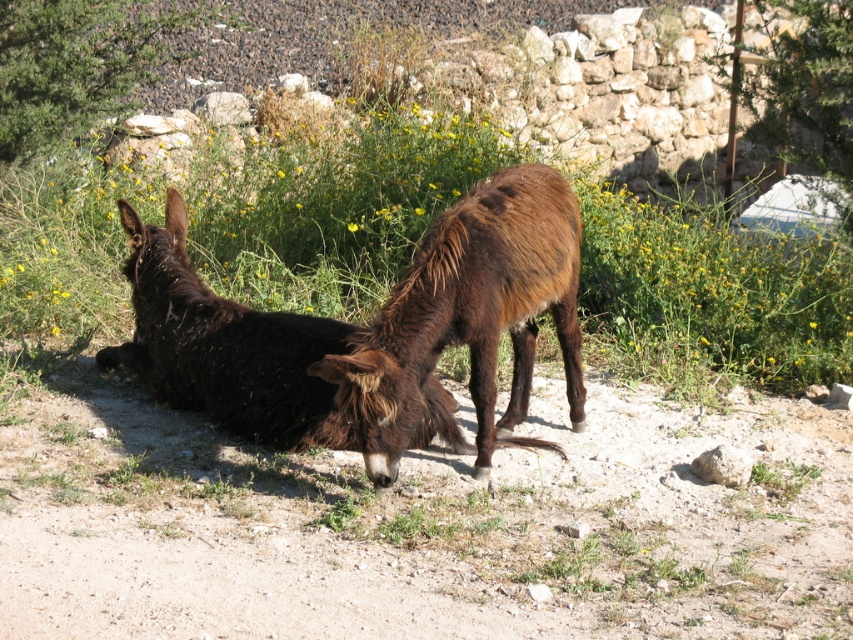
Question: Which of the following is the closest to the observer?

Choices:
 (A) brown fuzzy donkey at center
 (B) dark brown fur donkey at lower left

Answer: (A)

Question: Can you confirm if brown fuzzy donkey at center is thinner than dark brown fur donkey at lower left?

Choices:
 (A) no
 (B) yes

Answer: (B)

Question: Is brown fuzzy donkey at center above dark brown fur donkey at lower left?

Choices:
 (A) yes
 (B) no

Answer: (B)

Question: Can you confirm if brown fuzzy donkey at center is positioned to the left of dark brown fur donkey at lower left?

Choices:
 (A) no
 (B) yes

Answer: (A)